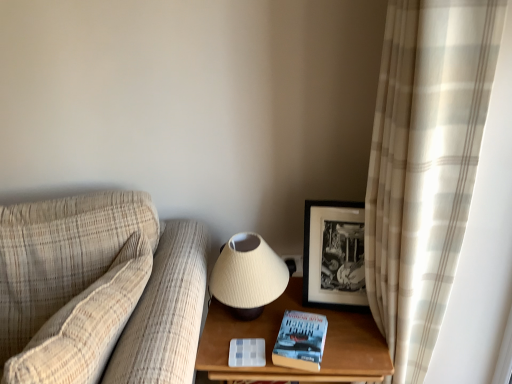
Locate an element on the screen. Image resolution: width=512 pixels, height=384 pixels. empty space that is ontop of hardcover blue book at lower right (from a real-world perspective) is located at coordinates (303, 332).